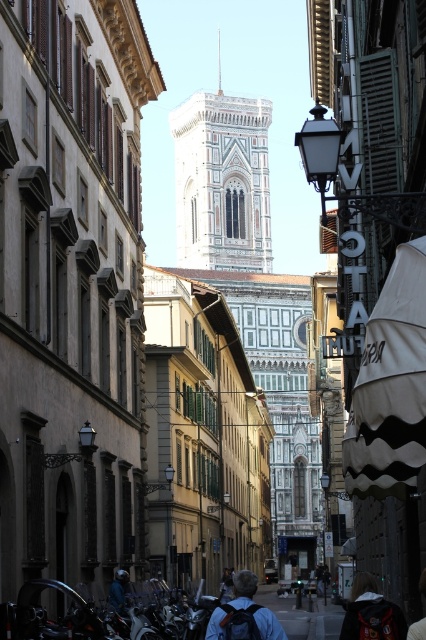
Does dark blue backpack at center lie in front of dark gray hoodie at lower center?

No, it is behind dark gray hoodie at lower center.

Does dark blue backpack at center appear on the left side of dark gray hoodie at lower center?

Indeed, dark blue backpack at center is positioned on the left side of dark gray hoodie at lower center.

This screenshot has height=640, width=426. Find the location of `dark blue backpack at center`. dark blue backpack at center is located at coordinates (244, 614).

This screenshot has width=426, height=640. What are the coordinates of `dark blue backpack at center` in the screenshot? It's located at (244, 614).

Does white striped fabric umbrella at center-right have a smaller size compared to blue denim jeans at lower center?

No.

Is white striped fabric umbrella at center-right wider than blue denim jeans at lower center?

Indeed, white striped fabric umbrella at center-right has a greater width compared to blue denim jeans at lower center.

Where is `white striped fabric umbrella at center-right`? This screenshot has height=640, width=426. white striped fabric umbrella at center-right is located at coordinates (391, 385).

Between white marble tower at center and dark gray hoodie at lower center, which one appears on the left side from the viewer's perspective?

From the viewer's perspective, white marble tower at center appears more on the left side.

Does white marble tower at center come behind dark gray hoodie at lower center?

Yes, it is behind dark gray hoodie at lower center.

Which is in front, point (249, 204) or point (382, 595)?

Point (382, 595) is in front.

Identify the location of white marble tower at center. This screenshot has width=426, height=640. (221, 180).